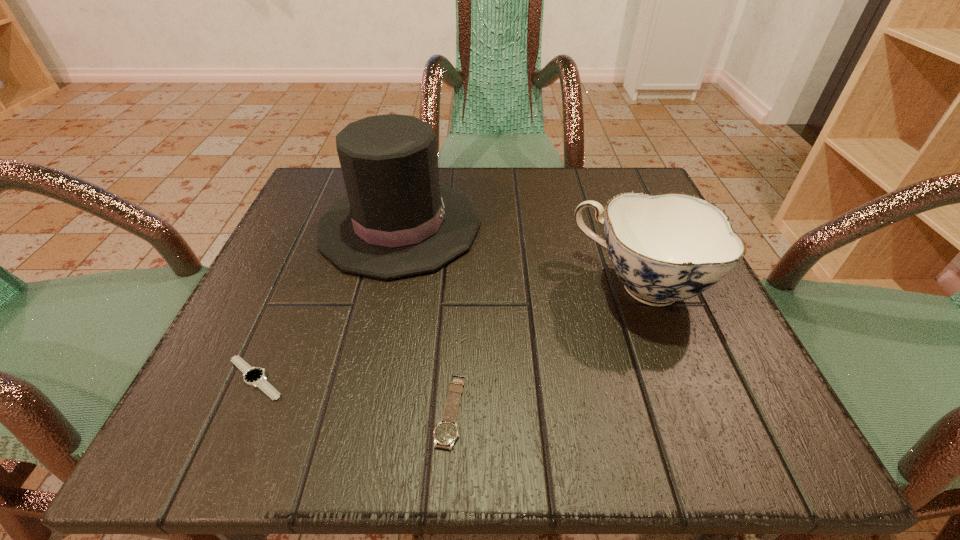
The width and height of the screenshot is (960, 540). Identify the location of free spot at the near left corner of the desktop. (243, 433).

In the image, there is a desktop. Where is `free region at the far right corner`? This screenshot has width=960, height=540. free region at the far right corner is located at coordinates (591, 168).

You are a GUI agent. You are given a task and a screenshot of the screen. Output one action in this format:
    pyautogui.click(x=<x>, y=<y>)
    Task: Click on the vacant space at the near right corner of the desktop
    The width and height of the screenshot is (960, 540).
    Given the screenshot: What is the action you would take?
    pyautogui.click(x=685, y=429)

At what (x,y) coordinates should I click in order to perform the action: click on unoccupied area between the second tallest object and the tallest object. Please return your answer as a coordinate pair (x, y). Looking at the image, I should click on (519, 255).

Locate an element on the screen. free spot between the left watch and the rightmost object is located at coordinates (447, 332).

Locate an element on the screen. The height and width of the screenshot is (540, 960). vacant area that lies between the left watch and the dress hat is located at coordinates (327, 302).

Where is `blank region between the rightmost object and the left watch`? The height and width of the screenshot is (540, 960). blank region between the rightmost object and the left watch is located at coordinates (447, 332).

Identify the location of vacant region between the left watch and the tallest object. (327, 302).

The image size is (960, 540). In order to click on vacant region between the right watch and the tallest object in this screenshot , I will do `click(425, 318)`.

At what (x,y) coordinates should I click in order to perform the action: click on vacant space that's between the second tallest object and the left watch. Please return your answer as a coordinate pair (x, y). This screenshot has height=540, width=960. Looking at the image, I should click on [447, 332].